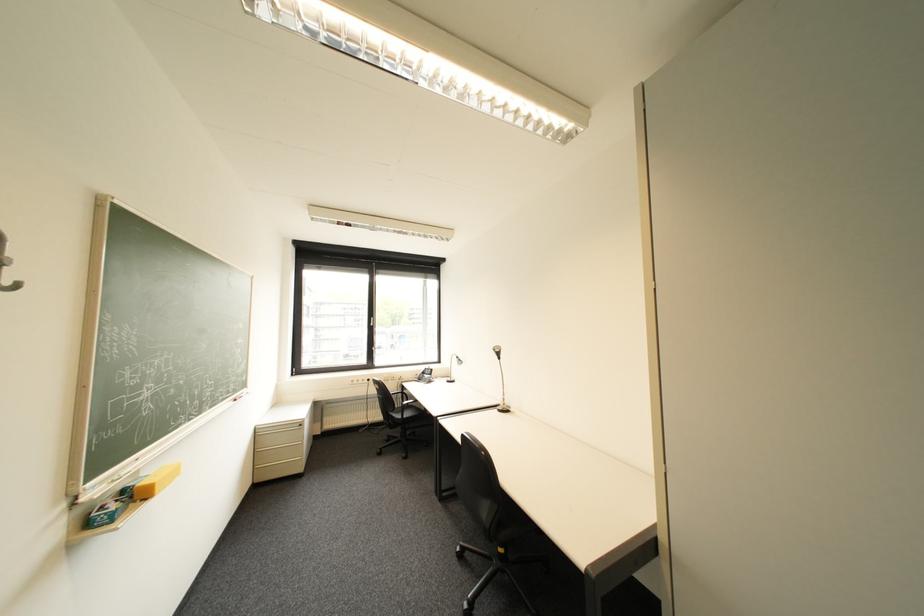
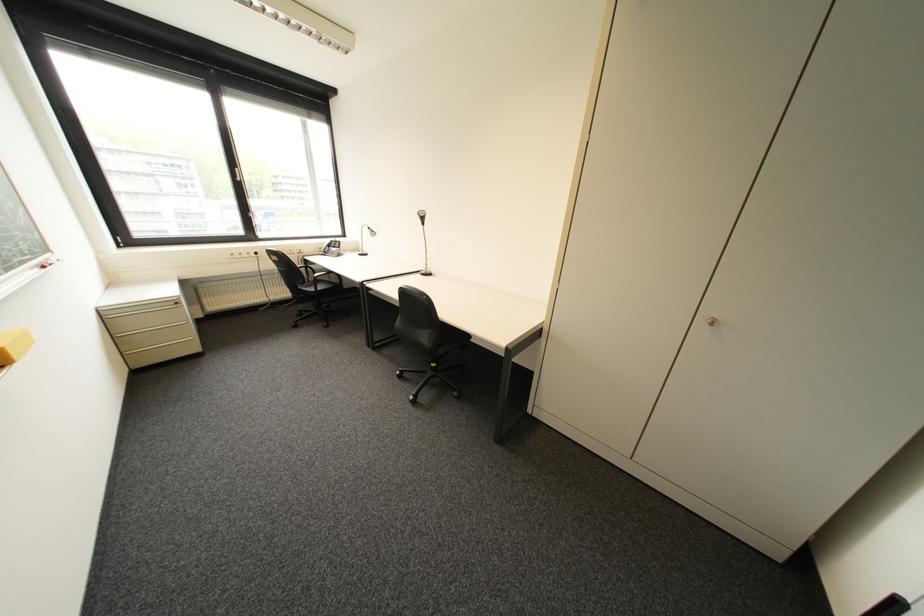
Locate, in the second image, the point that corresponds to (431,371) in the first image.

(335, 244)